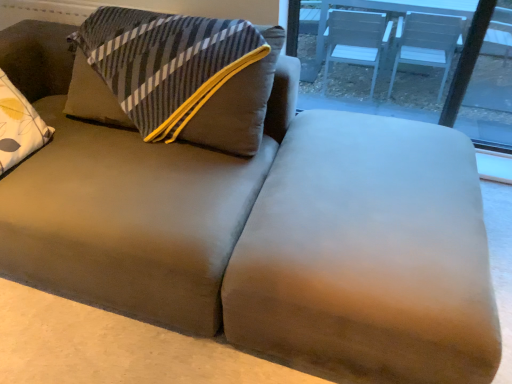
Question: Can you confirm if transparent glass table at upper right is taller than suede-like brown ottoman at center?

Choices:
 (A) yes
 (B) no

Answer: (A)

Question: Can you confirm if transparent glass table at upper right is smaller than suede-like brown ottoman at center?

Choices:
 (A) yes
 (B) no

Answer: (A)

Question: Is transparent glass table at upper right to the left of suede-like brown ottoman at center from the viewer's perspective?

Choices:
 (A) no
 (B) yes

Answer: (A)

Question: Is transparent glass table at upper right not close to suede-like brown ottoman at center?

Choices:
 (A) no
 (B) yes

Answer: (B)

Question: Is suede-like brown ottoman at center surrounded by transparent glass table at upper right?

Choices:
 (A) no
 (B) yes

Answer: (A)

Question: Can we say transparent glass table at upper right lies outside suede-like brown ottoman at center?

Choices:
 (A) no
 (B) yes

Answer: (B)

Question: Is suede-like brown ottoman at center at the left side of transparent glass table at upper right?

Choices:
 (A) no
 (B) yes

Answer: (B)

Question: Is the position of suede-like brown ottoman at center less distant than that of transparent glass table at upper right?

Choices:
 (A) no
 (B) yes

Answer: (B)

Question: Considering the relative sizes of suede-like brown ottoman at center and transparent glass table at upper right in the image provided, is suede-like brown ottoman at center taller than transparent glass table at upper right?

Choices:
 (A) no
 (B) yes

Answer: (A)

Question: From the image's perspective, does suede-like brown ottoman at center appear lower than transparent glass table at upper right?

Choices:
 (A) no
 (B) yes

Answer: (B)

Question: Considering the relative sizes of suede-like brown ottoman at center and transparent glass table at upper right in the image provided, is suede-like brown ottoman at center shorter than transparent glass table at upper right?

Choices:
 (A) no
 (B) yes

Answer: (B)

Question: Is suede-like brown ottoman at center next to transparent glass table at upper right?

Choices:
 (A) no
 (B) yes

Answer: (A)

Question: Considering the positions of transparent glass table at upper right and suede-like brown ottoman at center in the image, is transparent glass table at upper right bigger or smaller than suede-like brown ottoman at center?

Choices:
 (A) small
 (B) big

Answer: (A)